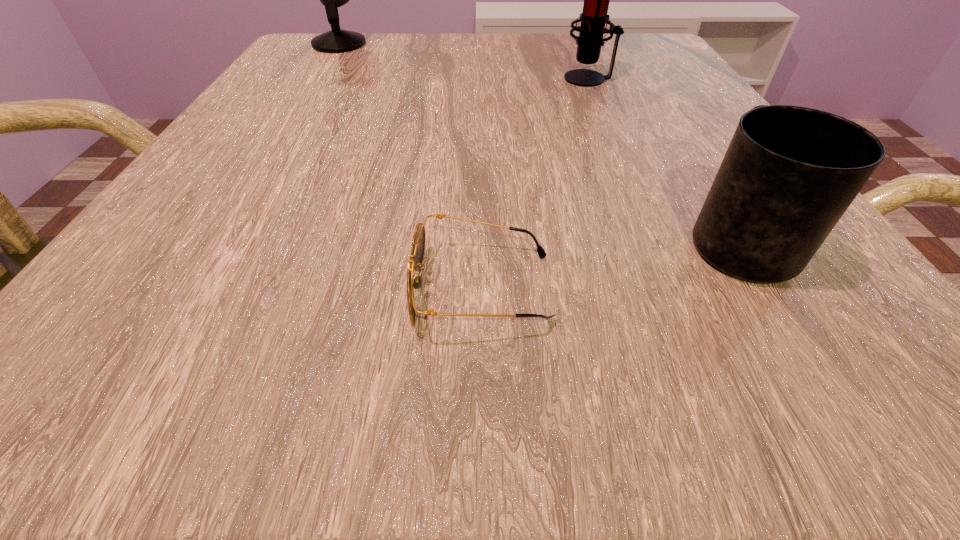
You are a GUI agent. You are given a task and a screenshot of the screen. Output one action in this format:
    pyautogui.click(x=<x>, y=<y>)
    Task: Click on the unoccupied position between the second farthest object and the sunglasses
    This screenshot has height=540, width=960.
    Given the screenshot: What is the action you would take?
    pyautogui.click(x=535, y=183)

Identify the location of free space between the second farthest object and the second shortest object. (663, 159).

You are a GUI agent. You are given a task and a screenshot of the screen. Output one action in this format:
    pyautogui.click(x=<x>, y=<y>)
    Task: Click on the vacant space that is in between the farther microphone and the shortest object
    Image resolution: width=960 pixels, height=540 pixels.
    Given the screenshot: What is the action you would take?
    pyautogui.click(x=410, y=166)

Where is `empty space that is in between the mug and the farther microphone`? This screenshot has height=540, width=960. empty space that is in between the mug and the farther microphone is located at coordinates (539, 141).

Identify the location of vacant area that lies between the third nearest object and the third tallest object. (663, 159).

What are the coordinates of `free spot between the second object from left to right and the second shortest object` in the screenshot? It's located at (610, 264).

Find the location of a particular element. This screenshot has width=960, height=540. vacant area between the sunglasses and the mug is located at coordinates (610, 264).

The height and width of the screenshot is (540, 960). Find the location of `vacant space in between the leftmost object and the nearer microphone`. vacant space in between the leftmost object and the nearer microphone is located at coordinates (464, 61).

Locate which object is the third closest to the sunglasses. Please provide its 2D coordinates. Your answer should be formatted as a tuple, i.e. [(x, y)], where the tuple contains the x and y coordinates of a point satisfying the conditions above.

[(336, 40)]

The width and height of the screenshot is (960, 540). I want to click on object that is the second closest to the third tallest object, so click(x=593, y=18).